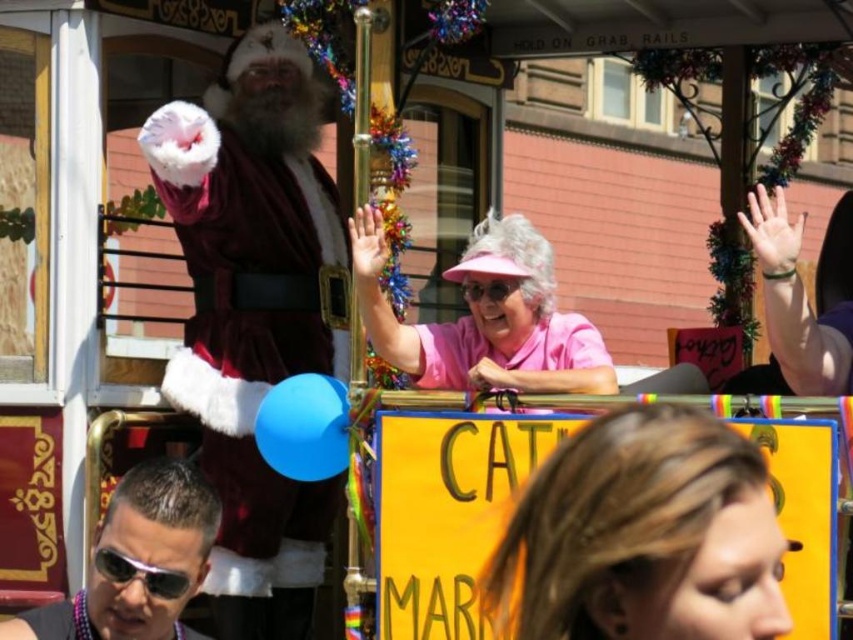
Does velvet maroon santa at left have a smaller size compared to sunglasses at center?

No.

Is the position of velvet maroon santa at left less distant than that of sunglasses at center?

That is False.

Identify the location of velvet maroon santa at left. The height and width of the screenshot is (640, 853). (254, 314).

Which is more to the left, pink fabric hat at upper center or sunglasses at center?

From the viewer's perspective, sunglasses at center appears more on the left side.

Between point (675, 444) and point (177, 580), which one is positioned in front?

Point (675, 444)

The height and width of the screenshot is (640, 853). Find the location of `pink fabric hat at upper center`. pink fabric hat at upper center is located at coordinates (642, 536).

Is pink matte shirt at center above sunglasses at center?

Indeed, pink matte shirt at center is positioned over sunglasses at center.

Can you confirm if pink matte shirt at center is positioned to the right of sunglasses at center?

Yes, pink matte shirt at center is to the right of sunglasses at center.

Which is in front, point (525, 388) or point (119, 582)?

Point (119, 582) is in front.

What are the coordinates of `pink matte shirt at center` in the screenshot? It's located at (473, 332).